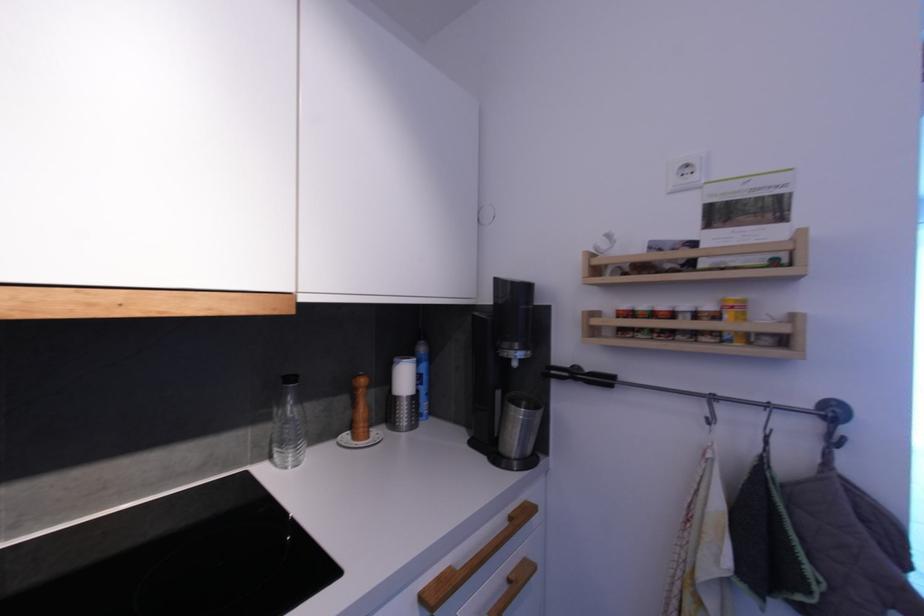
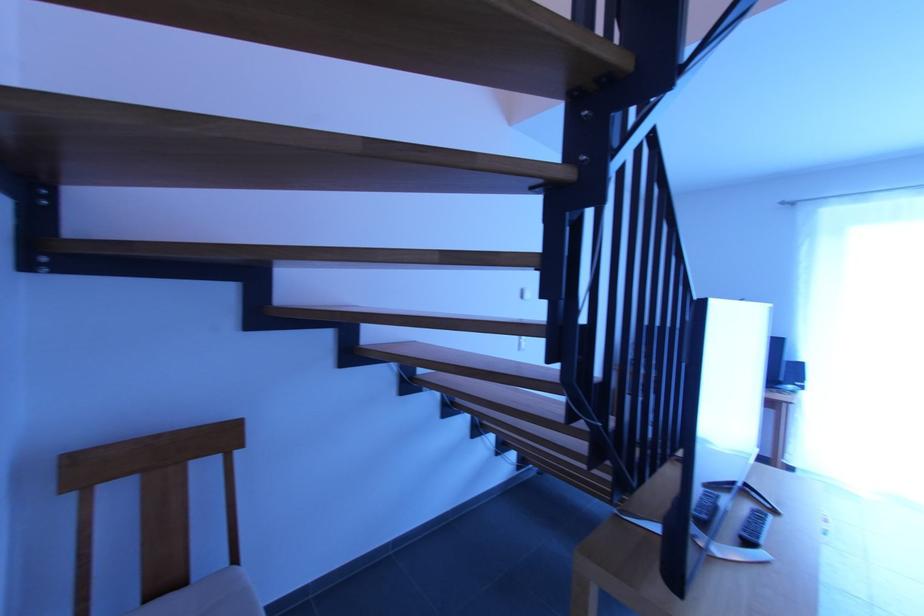
Which direction would the cameraman need to move to produce the second image?

The cameraman walked toward right, forward.